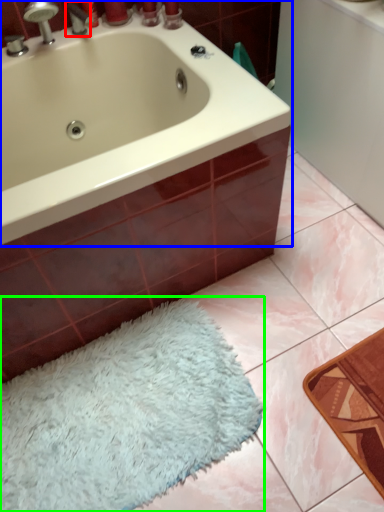
Question: Based on their relative distances, which object is nearer to tap (highlighted by a red box)? Choose from bathtub (highlighted by a blue box) and bath mat (highlighted by a green box).

Choices:
 (A) bathtub
 (B) bath mat

Answer: (A)